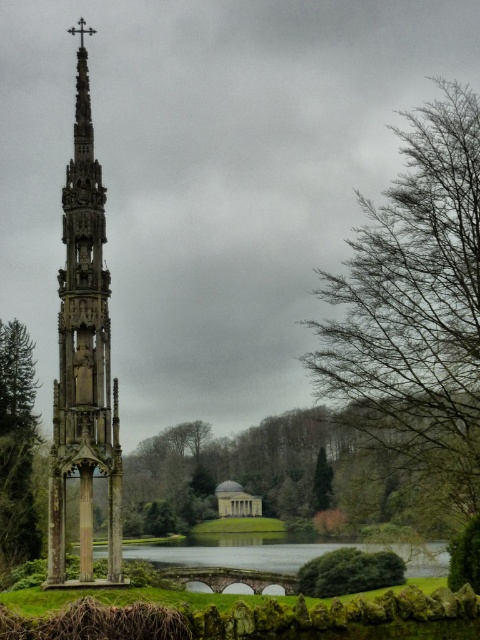
Between clear water at lower center and metallic cross at upper center, which one appears on the right side from the viewer's perspective?

clear water at lower center is more to the right.

At what (x,y) coordinates should I click in order to perform the action: click on clear water at lower center. Please return your answer as a coordinate pair (x, y). Looking at the image, I should click on tap(278, 552).

This screenshot has height=640, width=480. Identify the location of clear water at lower center. tap(278, 552).

Is stone carved tower at left shorter than clear water at lower center?

No, stone carved tower at left is not shorter than clear water at lower center.

Between point (108, 372) and point (425, 568), which one is positioned in front?

Positioned in front is point (108, 372).

At what (x,y) coordinates should I click in order to perform the action: click on stone carved tower at left. Please return your answer as a coordinate pair (x, y). Image resolution: width=480 pixels, height=640 pixels. Looking at the image, I should click on (84, 364).

From the picture: Does bare branches at right appear under clear water at lower center?

No.

Is point (408, 253) closer to camera compared to point (164, 550)?

Yes.

Where is `bare branches at right`? This screenshot has width=480, height=640. bare branches at right is located at coordinates (416, 307).